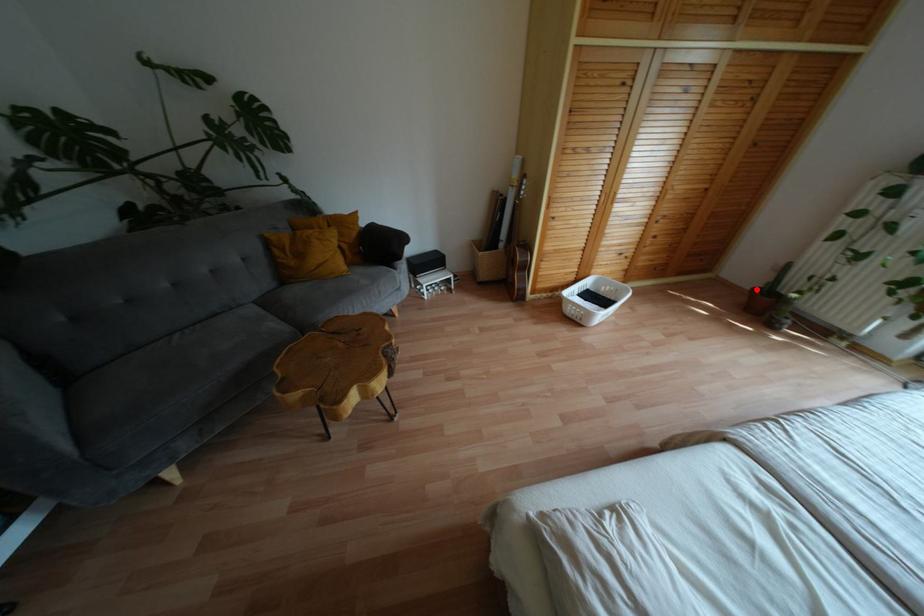
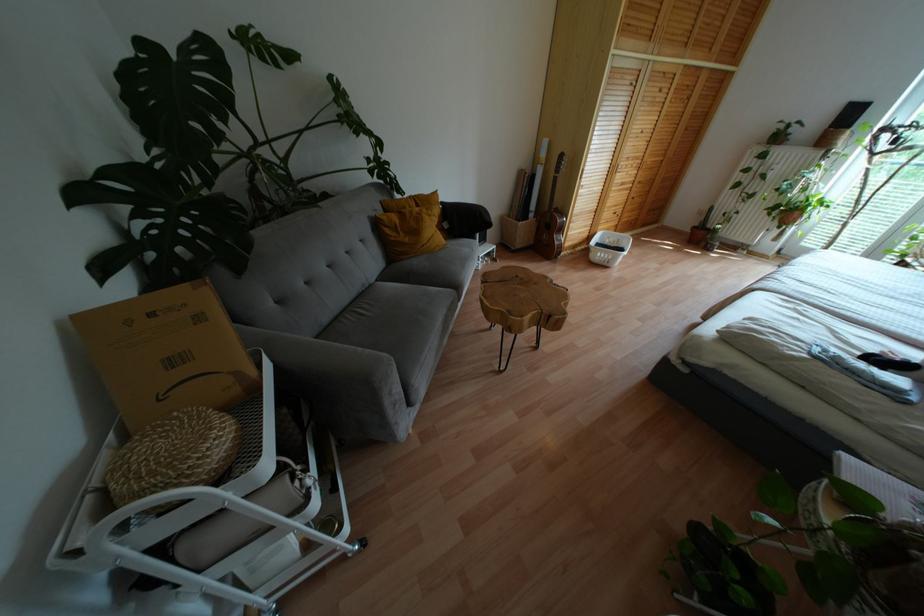
In the second image, find the point that corresponds to the highlighted location in the first image.

(694, 227)